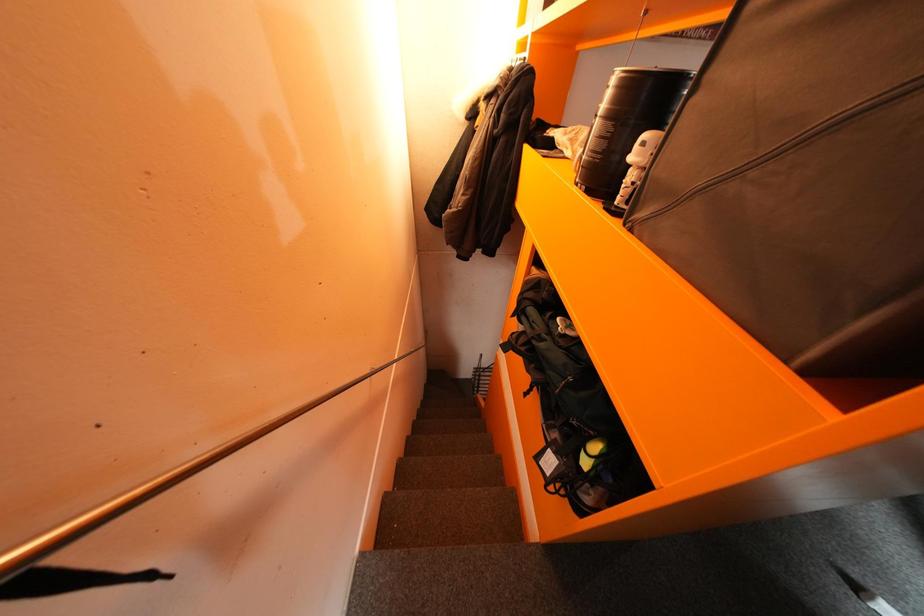
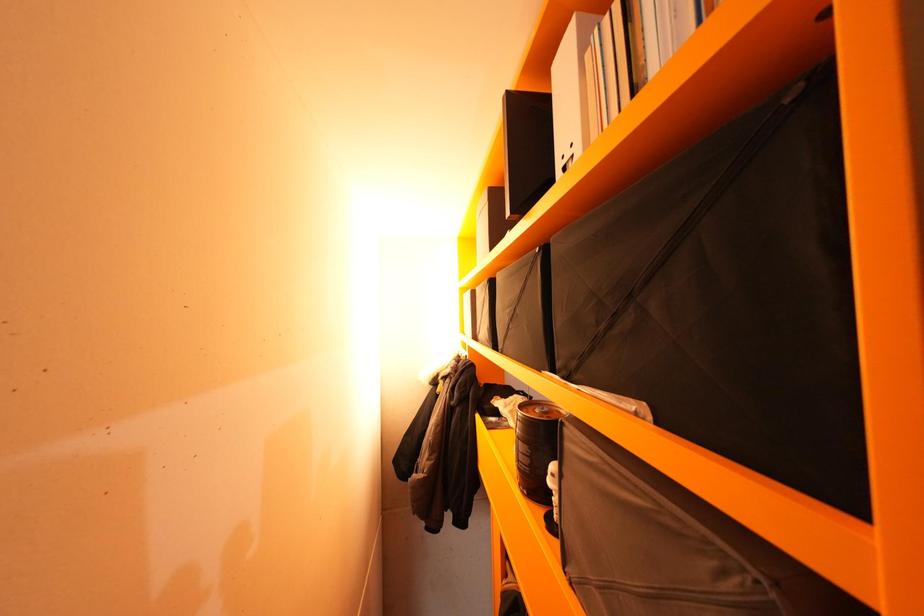
Question: The images are taken continuously from a first-person perspective. In which direction is your viewpoint rotating?

Choices:
 (A) Left
 (B) Right
 (C) Up
 (D) Down

Answer: (C)